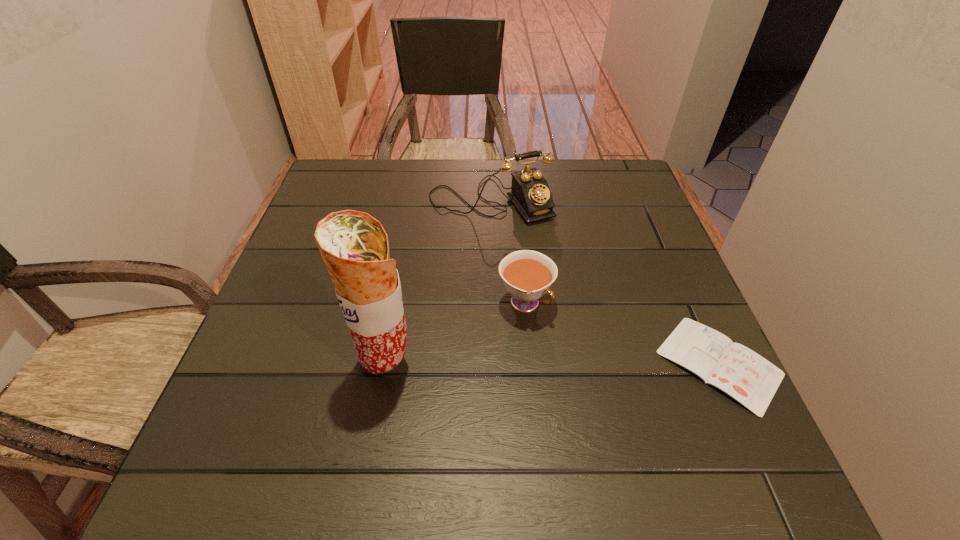
Where is `the tallest object`? This screenshot has height=540, width=960. the tallest object is located at coordinates (354, 246).

This screenshot has width=960, height=540. I want to click on the rightmost object, so click(x=750, y=379).

You are a GUI agent. You are given a task and a screenshot of the screen. Output one action in this format:
    pyautogui.click(x=<x>, y=<y>)
    Task: Click on the diary
    
    Given the screenshot: What is the action you would take?
    pyautogui.click(x=750, y=379)

At what (x,y) coordinates should I click in order to perform the action: click on telephone. Please return your answer as a coordinate pair (x, y). The width and height of the screenshot is (960, 540). Looking at the image, I should click on (530, 193).

Where is `the third shortest object`? Image resolution: width=960 pixels, height=540 pixels. the third shortest object is located at coordinates (530, 193).

Where is `teacup`? This screenshot has height=540, width=960. teacup is located at coordinates (527, 275).

Identify the location of vacant space positioned on the back of the tallest object. (401, 280).

Where is `free space located on the back of the shortest object`? Image resolution: width=960 pixels, height=540 pixels. free space located on the back of the shortest object is located at coordinates (657, 225).

This screenshot has height=540, width=960. Find the location of `vacant position located 0.240m on the dial of the farthest object`. vacant position located 0.240m on the dial of the farthest object is located at coordinates (556, 288).

This screenshot has height=540, width=960. Identify the location of vacant space located 0.090m on the dial of the farthest object. (528, 246).